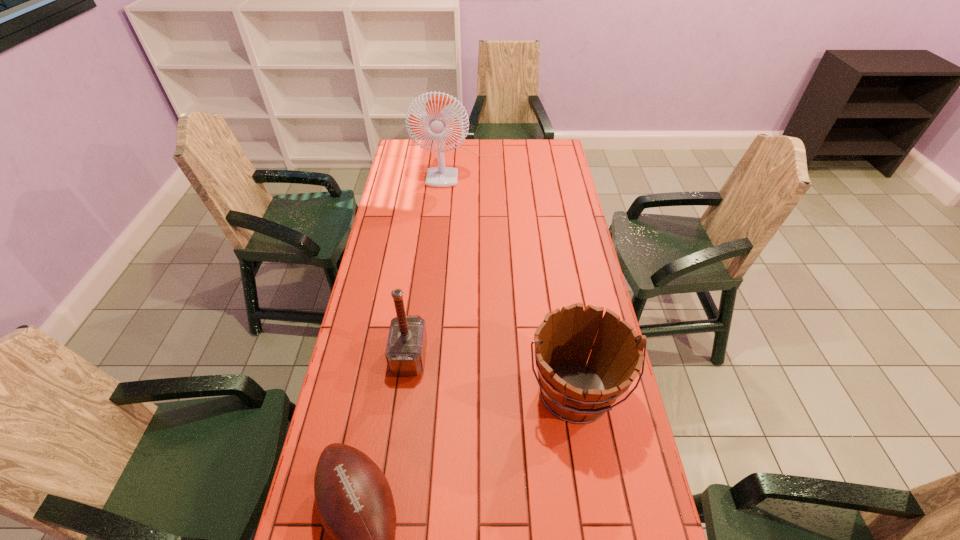
Identify which object is the closest to the fan. Please provide its 2D coordinates. Your answer should be formatted as a tuple, i.e. [(x, y)], where the tuple contains the x and y coordinates of a point satisfying the conditions above.

[(405, 352)]